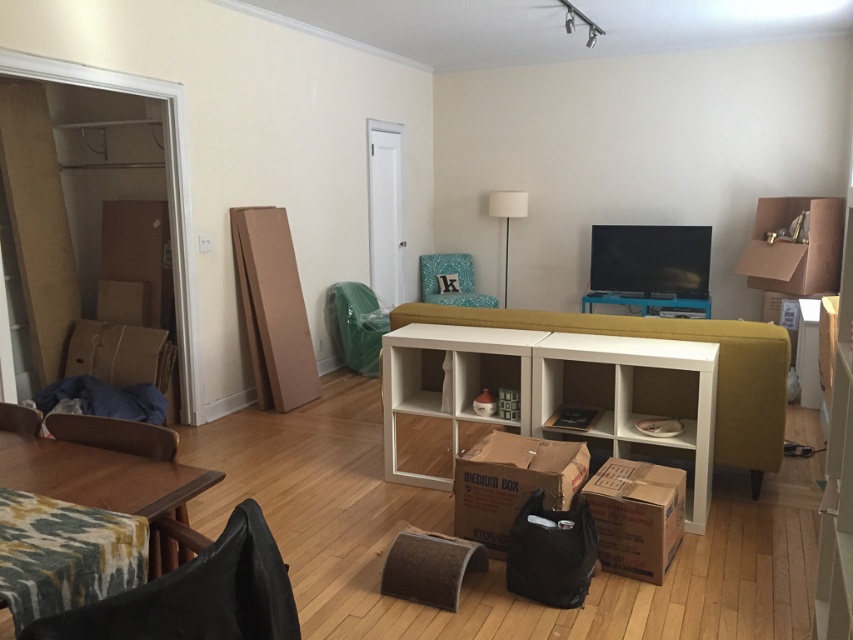
You are helping to organize the living room. You have a wooden table at lower left and a brown cardboard box at center. Which object can accommodate more items based on their size?

The wooden table at lower left is larger in size than the brown cardboard box at center, so it can accommodate more items.

You are standing at the entrance of the living room. Where is the wooden table at lower left located in terms of coordinates?

The wooden table at lower left is located at coordinates point (99, 476).

You are moving into this living room and need to place a new piece of furniture. You have a large rectangular item that requires a space closer to you. Which object should you consider moving to make room? The brown cardboard box at lower right or the wooden armchair at lower left?

The brown cardboard box at lower right is closer to you than the wooden armchair at lower left. To make space for your large rectangular item, you should move the brown cardboard box at lower right since it is closer and easier to access.